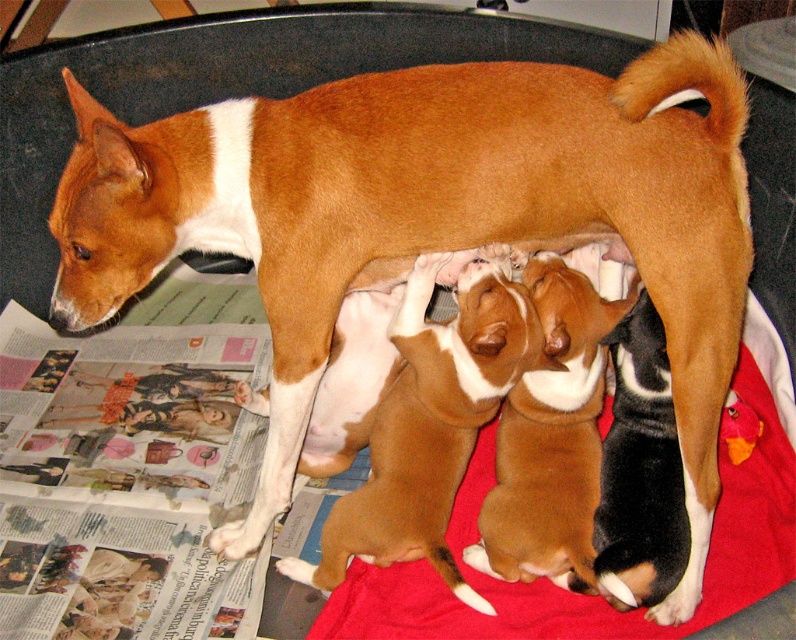
Question: Observing the image, what is the correct spatial positioning of brown soft fur puppies at center in reference to brown fur puppies at center?

Choices:
 (A) right
 (B) left

Answer: (B)

Question: Which object is positioned closest to the red fabric blanket at center?

Choices:
 (A) brown soft fur puppies at center
 (B) brown fur puppies at center

Answer: (B)

Question: Based on their relative distances, which object is farther from the red fabric blanket at center?

Choices:
 (A) brown fur puppies at center
 (B) brown soft fur puppies at center

Answer: (B)

Question: Does red fabric blanket at center appear on the left side of brown soft fur puppies at center?

Choices:
 (A) yes
 (B) no

Answer: (B)

Question: Which point appears closest to the camera in this image?

Choices:
 (A) (334, 508)
 (B) (498, 497)
 (C) (486, 636)

Answer: (C)

Question: Does red fabric blanket at center come in front of brown soft fur puppies at center?

Choices:
 (A) yes
 (B) no

Answer: (A)